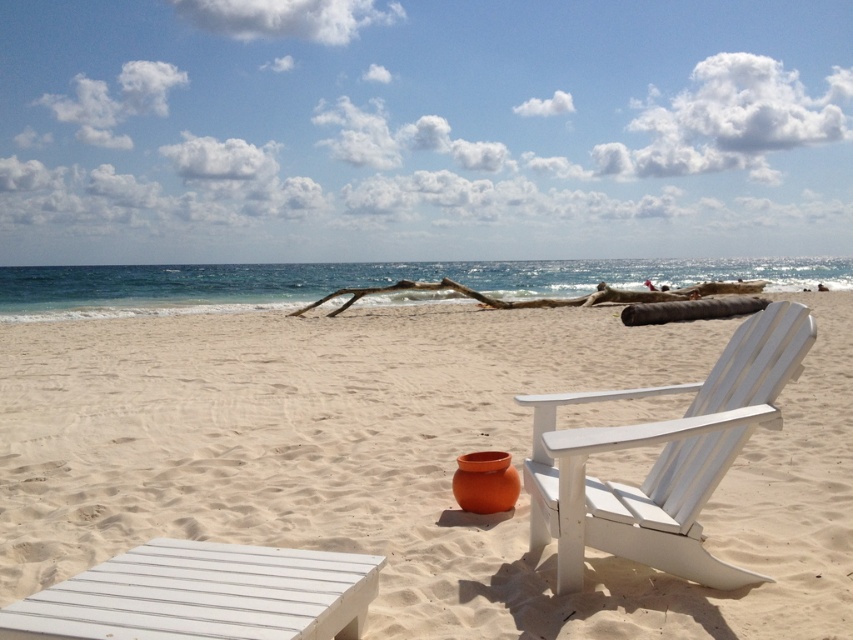
Is point (311, 328) more distant than point (660, 500)?

That is True.

Can you confirm if white sand at center is positioned to the right of white wood beach chair at center right?

Yes, white sand at center is to the right of white wood beach chair at center right.

What are the coordinates of `white sand at center` in the screenshot? It's located at (408, 460).

Is point (798, 364) closer to viewer compared to point (595, 296)?

Yes, it is in front of point (595, 296).

Which is behind, point (660, 529) or point (689, 316)?

The point (689, 316) is more distant.

Which is in front, point (595, 480) or point (555, 304)?

Positioned in front is point (595, 480).

Locate an element on the screen. white wood beach chair at center right is located at coordinates (662, 458).

Does point (734, 492) come closer to viewer compared to point (397, 291)?

That is True.

Describe the element at coordinates (408, 460) in the screenshot. I see `white sand at center` at that location.

Which is in front, point (202, 472) or point (628, 296)?

Positioned in front is point (202, 472).

I want to click on white sand at center, so click(408, 460).